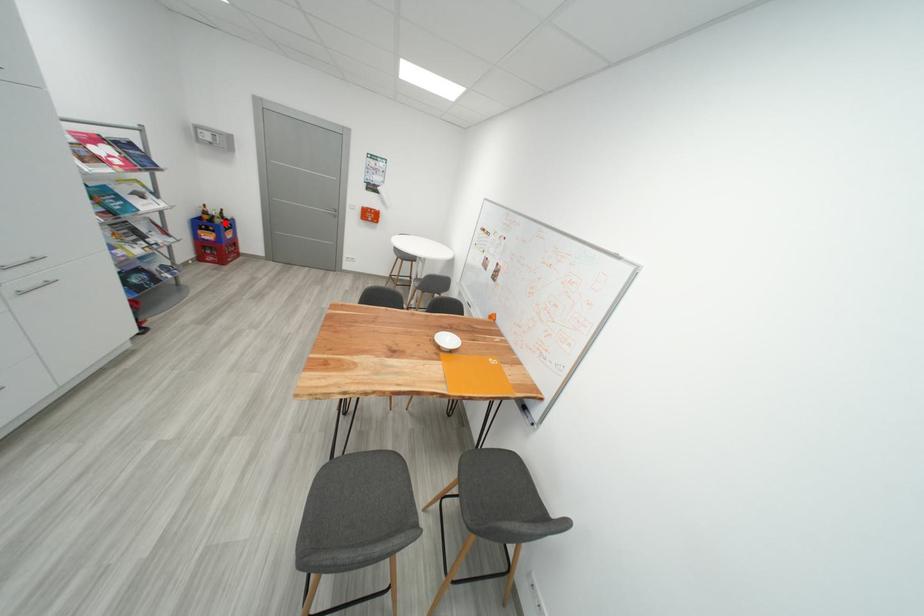
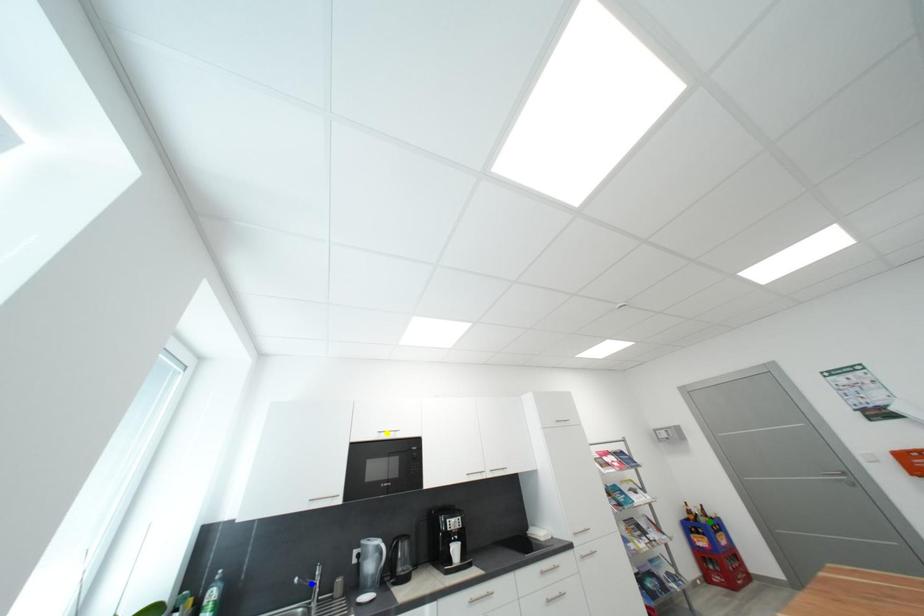
Question: I am providing you with two images of the same scene from different viewpoints. A red point is marked on the first image. You are given multiple points on the second image. Which spot in image 2 lines up with the point in image 1?

Choices:
 (A) green point
 (B) yellow point
 (C) blue point

Answer: (A)